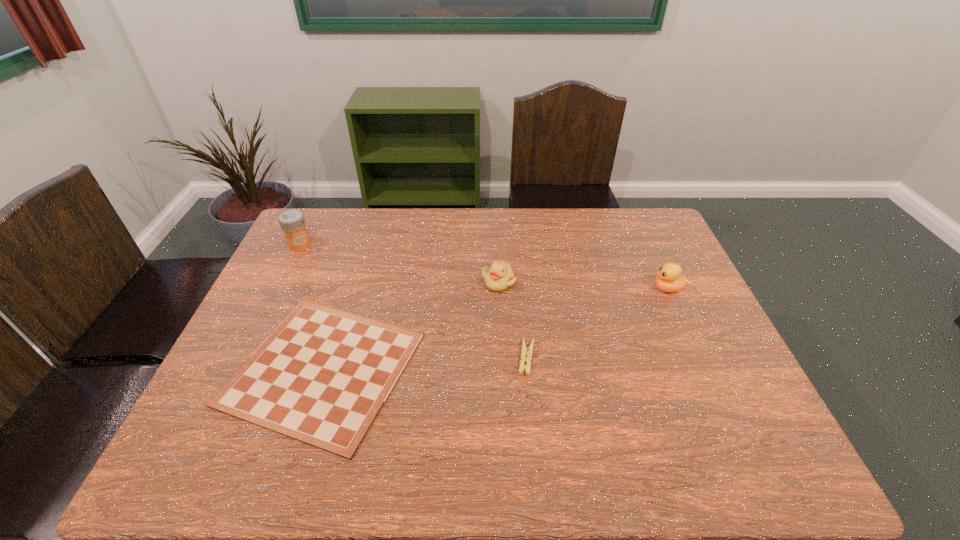
Where is `free region at the far edge`? The image size is (960, 540). free region at the far edge is located at coordinates (406, 221).

In the image, there is a desktop. Identify the location of vacant region at the left edge. (314, 271).

Where is `vacant space at the right edge of the desktop`? vacant space at the right edge of the desktop is located at coordinates (651, 255).

The height and width of the screenshot is (540, 960). Identify the location of vacant space at the far left corner. (332, 248).

In the image, there is a desktop. At what (x,y) coordinates should I click in order to perform the action: click on vacant space at the far right corner. Please return your answer as a coordinate pair (x, y). Looking at the image, I should click on (648, 232).

You are a GUI agent. You are given a task and a screenshot of the screen. Output one action in this format:
    pyautogui.click(x=<x>, y=<y>)
    Task: Click on the free point between the checkerboard and the left duckling
    
    Given the screenshot: What is the action you would take?
    pyautogui.click(x=411, y=325)

Where is `unoccupied position between the shortest object and the left duckling`? unoccupied position between the shortest object and the left duckling is located at coordinates (411, 325).

You are a GUI agent. You are given a task and a screenshot of the screen. Output one action in this format:
    pyautogui.click(x=<x>, y=<y>)
    Task: Click on the vacant area between the farthest object and the left duckling
    The image size is (960, 540).
    Given the screenshot: What is the action you would take?
    pyautogui.click(x=399, y=264)

The height and width of the screenshot is (540, 960). What are the coordinates of `free space that is in between the left duckling and the checkerboard` in the screenshot? It's located at click(411, 325).

The height and width of the screenshot is (540, 960). What are the coordinates of `unoccupied area between the second shortest object and the left duckling` in the screenshot? It's located at (513, 320).